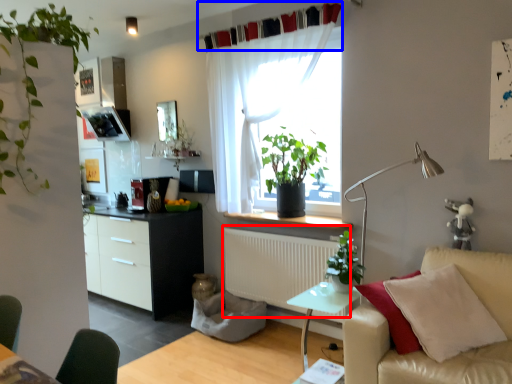
Question: Which object appears farthest to the camera in this image, radiator (highlighted by a red box) or curtain (highlighted by a blue box)?

Choices:
 (A) radiator
 (B) curtain

Answer: (A)